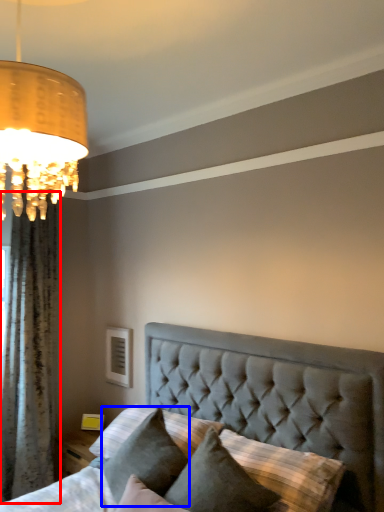
Question: Which object is closer to the camera taking this photo, curtain (highlighted by a red box) or pillow (highlighted by a blue box)?

Choices:
 (A) curtain
 (B) pillow

Answer: (B)